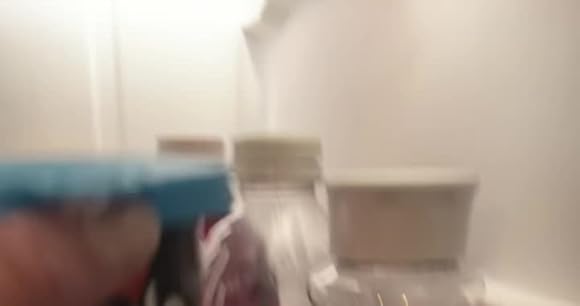
Where is `ident pattern on the wall`? Image resolution: width=580 pixels, height=306 pixels. ident pattern on the wall is located at coordinates click(x=108, y=73).